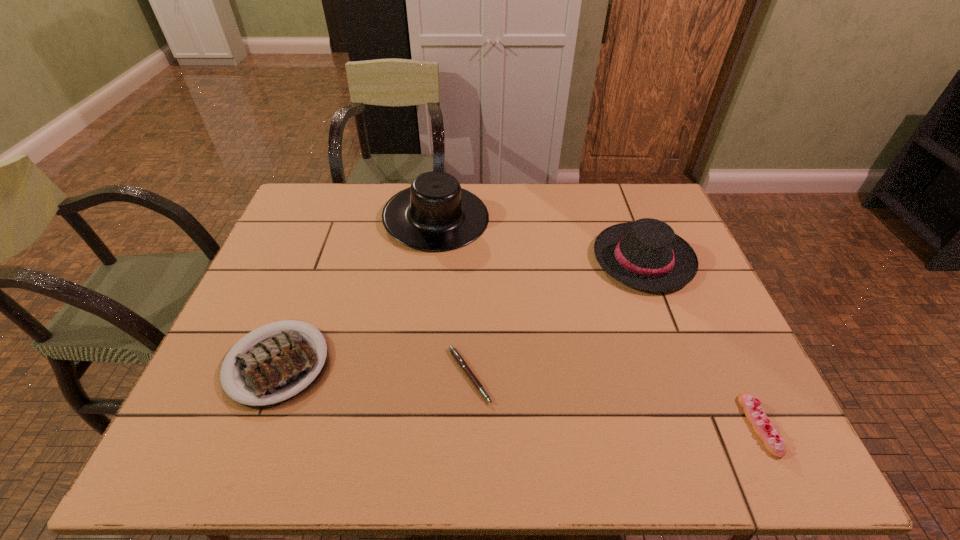
The width and height of the screenshot is (960, 540). In the image, there is a desktop. Identify the location of vacant space at the left edge. (290, 272).

This screenshot has height=540, width=960. Find the location of `free space at the right edge`. free space at the right edge is located at coordinates (662, 308).

Locate an element on the screen. free space at the far left corner is located at coordinates (304, 218).

This screenshot has height=540, width=960. In the image, there is a desktop. Find the location of `vacant space at the near left corner`. vacant space at the near left corner is located at coordinates (181, 447).

The height and width of the screenshot is (540, 960). In the image, there is a desktop. Identify the location of vacant space at the far right corner. tap(626, 200).

Identify the location of vacant space in between the taller dress hat and the right dress hat. This screenshot has height=540, width=960. (540, 239).

Locate an element on the screen. This screenshot has height=540, width=960. vacant space in between the pen and the shorter dress hat is located at coordinates (556, 318).

Find the location of `vacant space that is in between the shortest object and the eclair`. vacant space that is in between the shortest object and the eclair is located at coordinates (614, 400).

This screenshot has height=540, width=960. In order to click on free space that is in between the pen and the eclair in this screenshot , I will do `click(614, 400)`.

This screenshot has height=540, width=960. In order to click on empty space that is in between the second tallest object and the pen in this screenshot , I will do `click(556, 318)`.